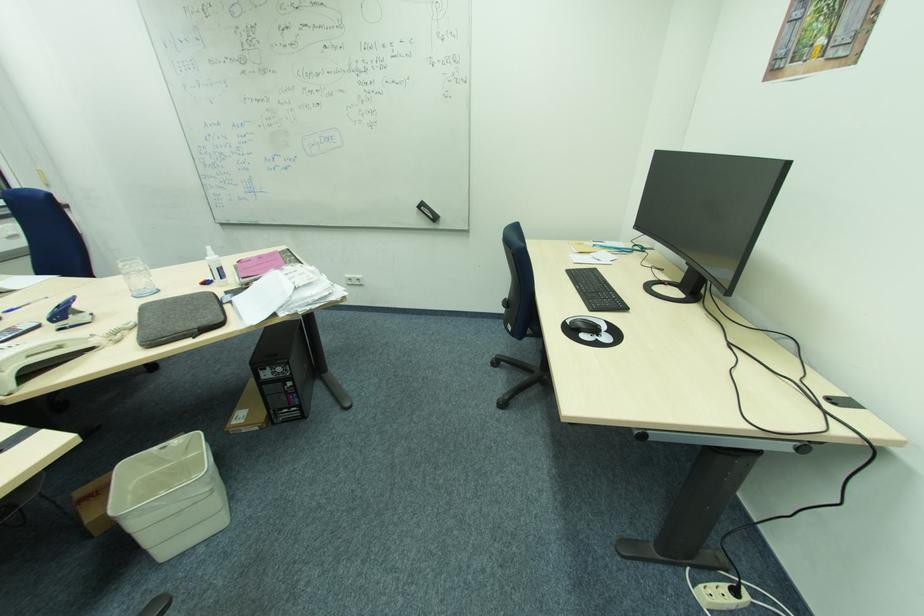
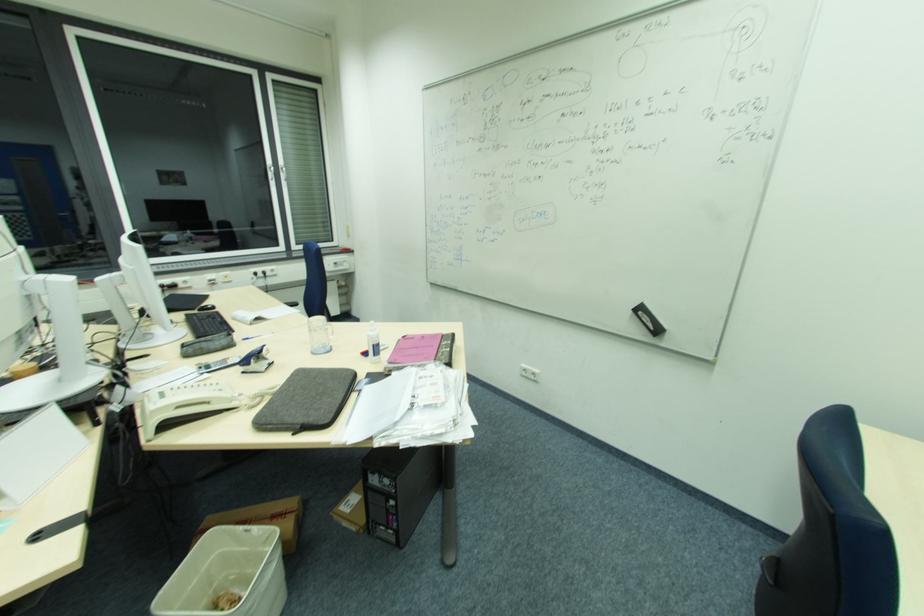
Locate, in the second image, the point that corresponds to pixel 216 298 in the first image.

(350, 382)